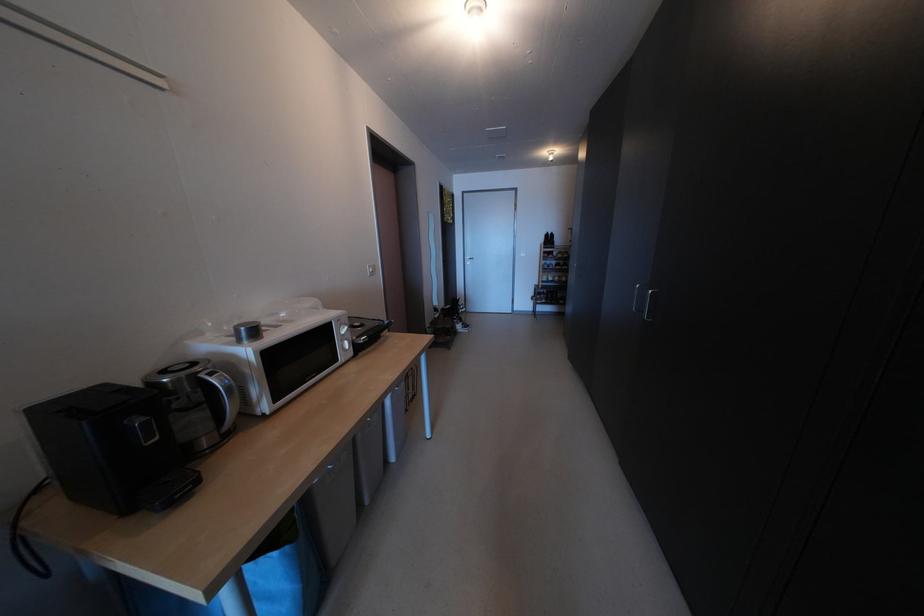
Where would you turn the silver microwave dial? Please return your answer as a coordinate pair (x, y).

(348, 328)